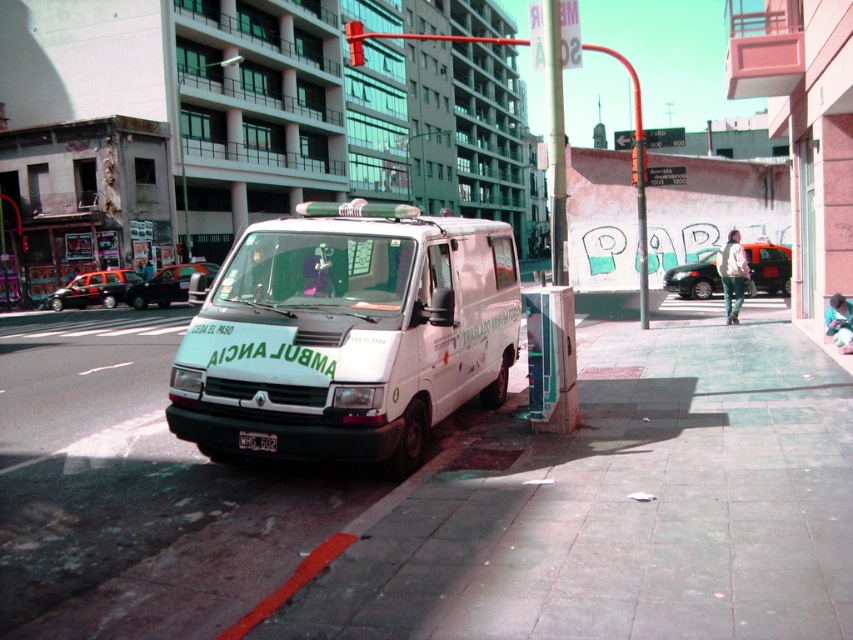
Question: Does white concrete sidewalk at lower center appear over white matte van at center?

Choices:
 (A) no
 (B) yes

Answer: (A)

Question: Which point is farther to the camera?

Choices:
 (A) (503, 406)
 (B) (508, 272)

Answer: (B)

Question: Is white concrete sidewalk at lower center bigger than white matte van at center?

Choices:
 (A) yes
 (B) no

Answer: (B)

Question: Which of the following is the farthest from the observer?

Choices:
 (A) white matte van at center
 (B) white concrete sidewalk at lower center

Answer: (A)

Question: Is white concrete sidewalk at lower center thinner than white matte van at center?

Choices:
 (A) yes
 (B) no

Answer: (B)